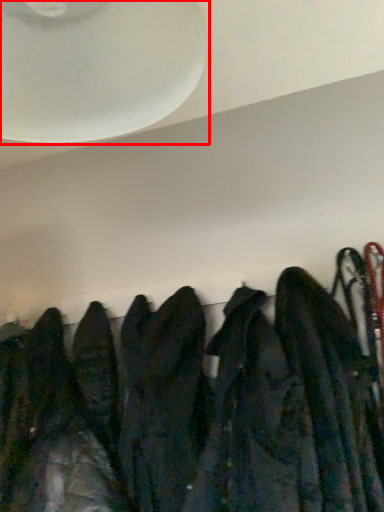
Question: In this image, where is fan (annotated by the red box) located relative to jacket?

Choices:
 (A) right
 (B) left

Answer: (B)